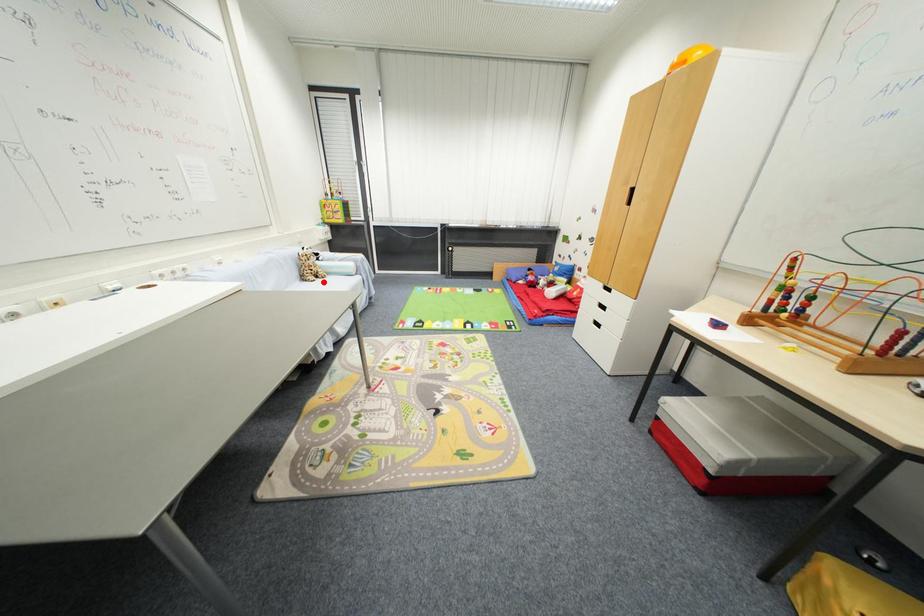
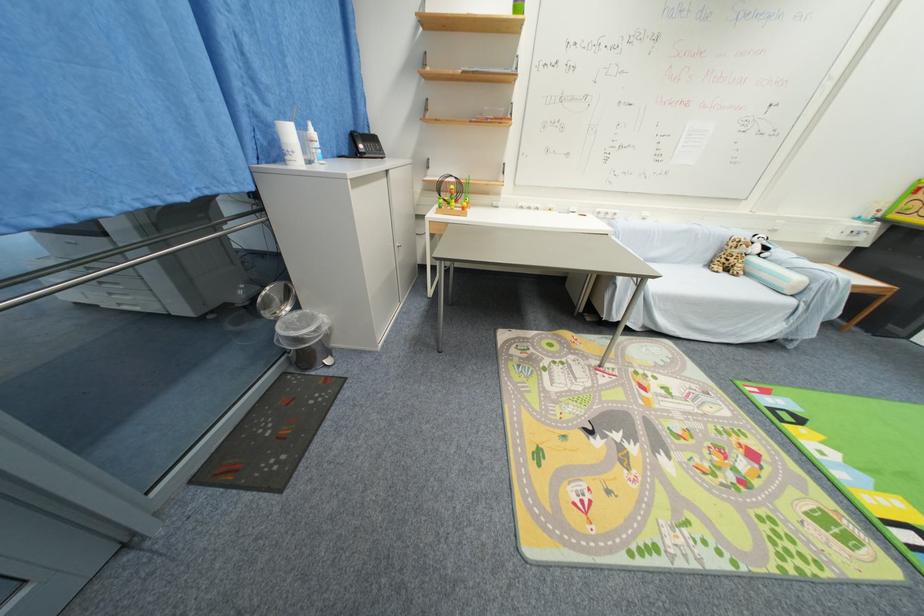
The point at the highlighted location is marked in the first image. Where is the corresponding point in the second image?

(730, 276)